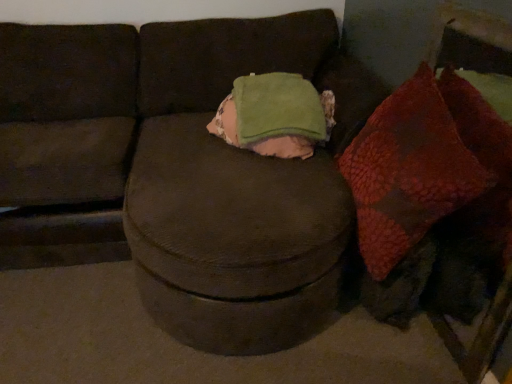
The image size is (512, 384). What do you see at coordinates (407, 171) in the screenshot? I see `textured red bean bag at right` at bounding box center [407, 171].

Image resolution: width=512 pixels, height=384 pixels. What do you see at coordinates (275, 115) in the screenshot?
I see `green fleece throw pillow at center` at bounding box center [275, 115].

Locate an element on the screen. green fleece throw pillow at center is located at coordinates (275, 115).

You are a GUI agent. You are given a task and a screenshot of the screen. Output one action in this format:
    pyautogui.click(x=<x>, y=<y>)
    Task: Click on the leather-like brown dog at lower right
    
    Given the screenshot: What is the action you would take?
    pyautogui.click(x=434, y=281)

Is textured red bean bag at right completely or partially inside brown fabric couch at center?

Yes, textured red bean bag at right is a part of brown fabric couch at center.

Which point is more forward, (305, 14) or (383, 231)?

The point (383, 231) is closer to the camera.

Can you confirm if brown fabric couch at center is taller than textured red bean bag at right?

Indeed, brown fabric couch at center has a greater height compared to textured red bean bag at right.

Is brown fabric couch at center shorter than leather-like brown dog at lower right?

No, brown fabric couch at center is not shorter than leather-like brown dog at lower right.

Considering the positions of objects brown fabric couch at center and leather-like brown dog at lower right in the image provided, who is in front, brown fabric couch at center or leather-like brown dog at lower right?

brown fabric couch at center is more forward.

Where is `studio couch located on the left of leather-like brown dog at lower right`? studio couch located on the left of leather-like brown dog at lower right is located at coordinates (181, 170).

Does point (350, 198) come farther from viewer compared to point (434, 240)?

No, (350, 198) is closer to viewer.

Could you tell me if leather-like brown dog at lower right is facing brown fabric couch at center?

Yes.

Is leather-like brown dog at lower right bigger than brown fabric couch at center?

Incorrect, leather-like brown dog at lower right is not larger than brown fabric couch at center.

Which object is positioned more to the right, textured red bean bag at right or green fleece throw pillow at center?

From the viewer's perspective, textured red bean bag at right appears more on the right side.

Is green fleece throw pillow at center at the back of textured red bean bag at right?

No.

Is the surface of textured red bean bag at right in direct contact with green fleece throw pillow at center?

No, textured red bean bag at right is not making contact with green fleece throw pillow at center.

Is brown fabric couch at center in front of or behind green fleece throw pillow at center in the image?

brown fabric couch at center is in front of green fleece throw pillow at center.

What's the angular difference between brown fabric couch at center and green fleece throw pillow at center's facing directions?

The angle between the facing direction of brown fabric couch at center and the facing direction of green fleece throw pillow at center is 2.31 degrees.

Is brown fabric couch at center positioned beyond the bounds of green fleece throw pillow at center?

Yes, brown fabric couch at center is outside of green fleece throw pillow at center.

How far apart are brown fabric couch at center and green fleece throw pillow at center?

12.74 inches.

Measure the distance from leather-like brown dog at lower right to textured red bean bag at right.

A distance of 10.97 inches exists between leather-like brown dog at lower right and textured red bean bag at right.

Can you confirm if leather-like brown dog at lower right is smaller than textured red bean bag at right?

Correct, leather-like brown dog at lower right occupies less space than textured red bean bag at right.

Would you consider leather-like brown dog at lower right to be distant from textured red bean bag at right?

No.

I want to click on animal located underneath the textured red bean bag at right (from a real-world perspective), so click(x=434, y=281).

Is point (269, 104) positioned before point (413, 107)?

No.

Does green fleece throw pillow at center have a lesser width compared to textured red bean bag at right?

No.

In the image, is green fleece throw pillow at center positioned in front of or behind textured red bean bag at right?

Visually, green fleece throw pillow at center is located behind textured red bean bag at right.

Where is `studio couch on the left of textured red bean bag at right`? This screenshot has width=512, height=384. studio couch on the left of textured red bean bag at right is located at coordinates (181, 170).

Where is `animal located on the right of brown fabric couch at center`? animal located on the right of brown fabric couch at center is located at coordinates (434, 281).

Considering their positions, is green fleece throw pillow at center positioned closer to textured red bean bag at right than brown fabric couch at center?

The object closer to textured red bean bag at right is green fleece throw pillow at center.

From the image, which object appears to be nearer to leather-like brown dog at lower right, green fleece throw pillow at center or brown fabric couch at center?

brown fabric couch at center is positioned closer to the anchor leather-like brown dog at lower right.

Consider the image. Considering their positions, is brown fabric couch at center positioned further to textured red bean bag at right than leather-like brown dog at lower right?

Based on the image, brown fabric couch at center appears to be further to textured red bean bag at right.

Considering their positions, is brown fabric couch at center positioned closer to textured red bean bag at right than green fleece throw pillow at center?

The object closer to textured red bean bag at right is green fleece throw pillow at center.

Considering their positions, is leather-like brown dog at lower right positioned closer to brown fabric couch at center than textured red bean bag at right?

The object closer to brown fabric couch at center is textured red bean bag at right.

From the image, which object appears to be nearer to green fleece throw pillow at center, leather-like brown dog at lower right or brown fabric couch at center?

brown fabric couch at center lies closer to green fleece throw pillow at center than the other object.

Consider the image. From the image, which object appears to be farther from leather-like brown dog at lower right, textured red bean bag at right or green fleece throw pillow at center?

The object further to leather-like brown dog at lower right is green fleece throw pillow at center.

Based on the photo, from the image, which object appears to be farther from green fleece throw pillow at center, brown fabric couch at center or leather-like brown dog at lower right?

leather-like brown dog at lower right lies further to green fleece throw pillow at center than the other object.

This screenshot has width=512, height=384. In order to click on bean bag chair between green fleece throw pillow at center and leather-like brown dog at lower right in the up-down direction in this screenshot , I will do `click(407, 171)`.

The image size is (512, 384). I want to click on bean bag chair between brown fabric couch at center and leather-like brown dog at lower right in the horizontal direction, so click(x=407, y=171).

Image resolution: width=512 pixels, height=384 pixels. I want to click on throw pillow located between brown fabric couch at center and leather-like brown dog at lower right in the left-right direction, so click(x=275, y=115).

I want to click on throw pillow between brown fabric couch at center and textured red bean bag at right in the horizontal direction, so click(275, 115).